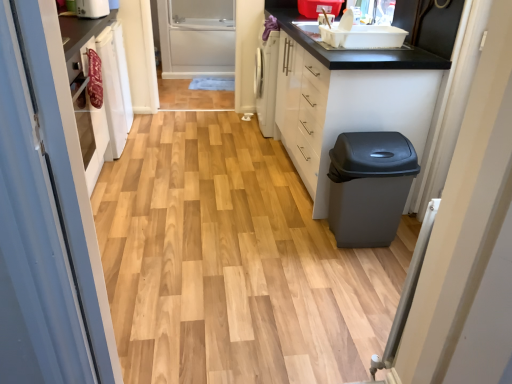
Question: Should I look upward or downward to see white plastic toaster at upper left?

Choices:
 (A) down
 (B) up

Answer: (B)

Question: Can you confirm if matte gray trash can at right is taller than wooden floor at center?

Choices:
 (A) yes
 (B) no

Answer: (A)

Question: Is matte gray trash can at right positioned with its back to wooden floor at center?

Choices:
 (A) yes
 (B) no

Answer: (B)

Question: Is matte gray trash can at right with wooden floor at center?

Choices:
 (A) no
 (B) yes

Answer: (A)

Question: Can you confirm if matte gray trash can at right is bigger than wooden floor at center?

Choices:
 (A) yes
 (B) no

Answer: (B)

Question: Considering the relative sizes of matte gray trash can at right and wooden floor at center in the image provided, is matte gray trash can at right wider than wooden floor at center?

Choices:
 (A) no
 (B) yes

Answer: (A)

Question: Is matte gray trash can at right shorter than wooden floor at center?

Choices:
 (A) no
 (B) yes

Answer: (A)

Question: Is white glossy cabinet at right at the right side of white plastic toaster at upper left?

Choices:
 (A) no
 (B) yes

Answer: (B)

Question: Does white glossy cabinet at right have a lesser width compared to white plastic toaster at upper left?

Choices:
 (A) yes
 (B) no

Answer: (B)

Question: Is white glossy cabinet at right positioned behind white plastic toaster at upper left?

Choices:
 (A) yes
 (B) no

Answer: (B)

Question: Does white glossy cabinet at right turn towards white plastic toaster at upper left?

Choices:
 (A) yes
 (B) no

Answer: (A)

Question: Is white glossy cabinet at right far away from white plastic toaster at upper left?

Choices:
 (A) yes
 (B) no

Answer: (A)

Question: Considering the relative sizes of white glossy cabinet at right and white plastic toaster at upper left in the image provided, is white glossy cabinet at right wider than white plastic toaster at upper left?

Choices:
 (A) no
 (B) yes

Answer: (B)

Question: Does white plastic toaster at upper left have a larger size compared to matte gray trash can at right?

Choices:
 (A) no
 (B) yes

Answer: (A)